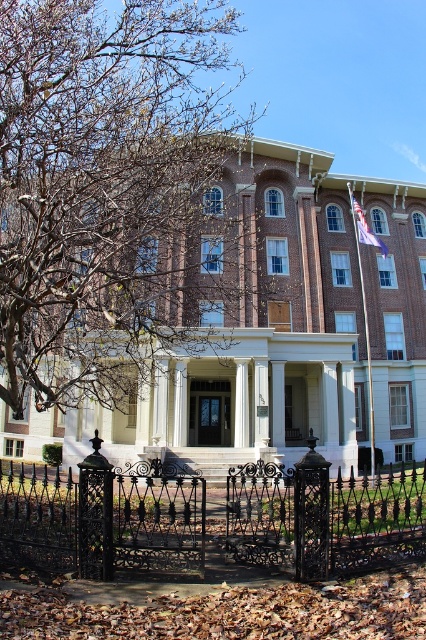
Question: Estimate the real-world distances between objects in this image. Which object is farther from the black wrought iron gate at lower center?

Choices:
 (A) brown leafy tree at upper left
 (B) white fabric flag at upper right

Answer: (B)

Question: Observing the image, what is the correct spatial positioning of brown leafy tree at upper left in reference to white fabric flag at upper right?

Choices:
 (A) above
 (B) below

Answer: (A)

Question: Is brown leafy tree at upper left positioned in front of black wrought iron gate at lower center?

Choices:
 (A) no
 (B) yes

Answer: (A)

Question: Is brown leafy tree at upper left below white fabric flag at upper right?

Choices:
 (A) yes
 (B) no

Answer: (B)

Question: Which point is farther to the camera?

Choices:
 (A) (224, 64)
 (B) (356, 208)

Answer: (B)

Question: Which of these objects is positioned farthest from the black wrought iron gate at lower center?

Choices:
 (A) white fabric flag at upper right
 (B) brown leafy tree at upper left

Answer: (A)